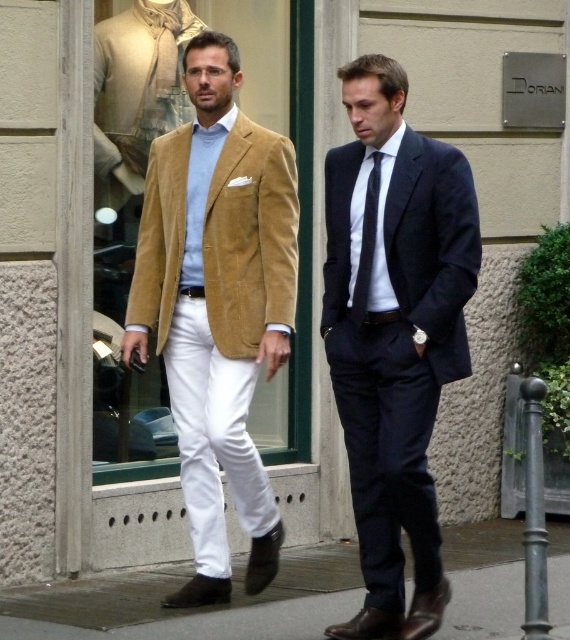
Does velvet gold jacket at left have a larger size compared to dark blue silk tie at center?

Yes, velvet gold jacket at left is bigger than dark blue silk tie at center.

Between velvet gold jacket at left and dark blue silk tie at center, which one is positioned lower?

dark blue silk tie at center is lower down.

Does point (258, 272) lie behind point (380, 156)?

Yes, point (258, 272) is farther from viewer.

Identify the location of velvet gold jacket at left. (258, 225).

Is velvet gold blazer at center to the left of velvet gold jacket at left from the viewer's perspective?

Yes, velvet gold blazer at center is to the left of velvet gold jacket at left.

Does point (254, 150) come closer to viewer compared to point (262, 232)?

No, (254, 150) is behind (262, 232).

Between point (237, 371) and point (249, 161), which one is positioned behind?

Positioned behind is point (249, 161).

In order to click on velvet gold blazer at center in this screenshot , I will do `click(217, 305)`.

Can you confirm if matte navy suit at right is bigger than dark blue silk tie at center?

Correct, matte navy suit at right is larger in size than dark blue silk tie at center.

Looking at this image, who is more forward, (462, 332) or (357, 280)?

Point (462, 332) is in front.

Does point (424, 476) lie behind point (360, 273)?

No, it is in front of (360, 273).

Locate an element on the screen. matte navy suit at right is located at coordinates (394, 333).